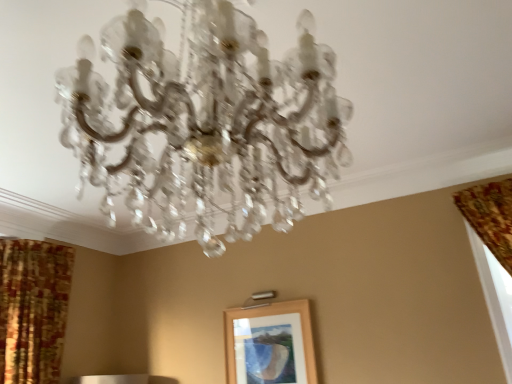
The height and width of the screenshot is (384, 512). I want to click on clear crystal chandelier at center, so click(x=206, y=122).

Considering the relative sizes of wooden picture frame at center and clear crystal chandelier at center in the image provided, is wooden picture frame at center bigger than clear crystal chandelier at center?

No.

Choose the correct answer: Is wooden picture frame at center inside clear crystal chandelier at center or outside it?

wooden picture frame at center is spatially situated outside clear crystal chandelier at center.

Is wooden picture frame at center taller or shorter than clear crystal chandelier at center?

Clearly, wooden picture frame at center is shorter compared to clear crystal chandelier at center.

Could you tell me if wooden picture frame at center is facing clear crystal chandelier at center?

Yes, wooden picture frame at center is oriented towards clear crystal chandelier at center.

From a real-world perspective, between patterned fabric curtain at left and wooden picture frame at center, who is vertically higher?

In real-world perspective, patterned fabric curtain at left is above.

In terms of size, does patterned fabric curtain at left appear bigger or smaller than wooden picture frame at center?

patterned fabric curtain at left is bigger than wooden picture frame at center.

Is patterned fabric curtain at left behind wooden picture frame at center?

No, the depth of patterned fabric curtain at left is less than that of wooden picture frame at center.

In the scene shown: Is wooden picture frame at center oriented away from patterned fabric curtain at left?

No, wooden picture frame at center is not facing the opposite direction of patterned fabric curtain at left.

Looking at this image, from a real-world perspective, is wooden picture frame at center on patterned fabric curtain at left?

Incorrect, from a real-world perspective, wooden picture frame at center is lower than patterned fabric curtain at left.

Considering the sizes of objects wooden picture frame at center and patterned fabric curtain at left in the image provided, who is smaller, wooden picture frame at center or patterned fabric curtain at left?

wooden picture frame at center.

What's the angular difference between wooden picture frame at center and patterned fabric curtain at left's facing directions?

They differ by 168 degrees in their facing directions.

Is point (8, 316) closer or farther from the camera than point (323, 192)?

Point (8, 316) is farther from the camera than point (323, 192).

From a real-world perspective, is patterned fabric curtain at left beneath clear crystal chandelier at center?

Yes, from a real-world perspective, patterned fabric curtain at left is beneath clear crystal chandelier at center.

From the picture: Between patterned fabric curtain at left and clear crystal chandelier at center, which one appears on the right side from the viewer's perspective?

Positioned to the right is clear crystal chandelier at center.

Is patterned fabric curtain at left aimed at clear crystal chandelier at center?

No, patterned fabric curtain at left is not facing towards clear crystal chandelier at center.

You are a GUI agent. You are given a task and a screenshot of the screen. Output one action in this format:
    pyautogui.click(x=<x>, y=<y>)
    Task: Click on the lamp above the patterned fabric curtain at left (from the image's perspective)
    The height and width of the screenshot is (384, 512).
    Given the screenshot: What is the action you would take?
    pyautogui.click(x=206, y=122)

From the image's perspective, is clear crystal chandelier at center located above or below patterned fabric curtain at left?

Clearly, from the image's perspective, clear crystal chandelier at center is above patterned fabric curtain at left.

Can you see clear crystal chandelier at center touching patterned fabric curtain at left?

clear crystal chandelier at center and patterned fabric curtain at left are clearly separated.

Looking at this image, is clear crystal chandelier at center wider than patterned fabric curtain at left?

Indeed, clear crystal chandelier at center has a greater width compared to patterned fabric curtain at left.

Which object is further away from the camera, clear crystal chandelier at center or wooden picture frame at center?

wooden picture frame at center.

In order to click on lamp that appears above the wooden picture frame at center (from a real-world perspective) in this screenshot , I will do `click(206, 122)`.

Is clear crystal chandelier at center thinner than wooden picture frame at center?

Incorrect, the width of clear crystal chandelier at center is not less than that of wooden picture frame at center.

From the image's perspective, would you say clear crystal chandelier at center is positioned over wooden picture frame at center?

Correct, clear crystal chandelier at center appears higher than wooden picture frame at center in the image.

Find the location of a particular element. The width and height of the screenshot is (512, 384). picture frame below the clear crystal chandelier at center (from a real-world perspective) is located at coordinates (270, 344).

At what (x,y) coordinates should I click in order to perform the action: click on picture frame on the right side of patterned fabric curtain at left. Please return your answer as a coordinate pair (x, y). The height and width of the screenshot is (384, 512). Looking at the image, I should click on (270, 344).

From the image, which object appears to be farther from clear crystal chandelier at center, patterned fabric curtain at left or wooden picture frame at center?

patterned fabric curtain at left is further to clear crystal chandelier at center.

Estimate the real-world distances between objects in this image. Which object is further from wooden picture frame at center, clear crystal chandelier at center or patterned fabric curtain at left?

clear crystal chandelier at center lies further to wooden picture frame at center than the other object.

Based on the photo, based on their spatial positions, is patterned fabric curtain at left or clear crystal chandelier at center closer to wooden picture frame at center?

The object closer to wooden picture frame at center is patterned fabric curtain at left.

From the image, which object appears to be nearer to patterned fabric curtain at left, clear crystal chandelier at center or wooden picture frame at center?

The object closer to patterned fabric curtain at left is wooden picture frame at center.

Considering their positions, is wooden picture frame at center positioned further to patterned fabric curtain at left than clear crystal chandelier at center?

clear crystal chandelier at center lies further to patterned fabric curtain at left than the other object.

When comparing their distances from clear crystal chandelier at center, does wooden picture frame at center or patterned fabric curtain at left seem closer?

Among the two, wooden picture frame at center is located nearer to clear crystal chandelier at center.

I want to click on curtain between clear crystal chandelier at center and wooden picture frame at center from front to back, so click(33, 309).